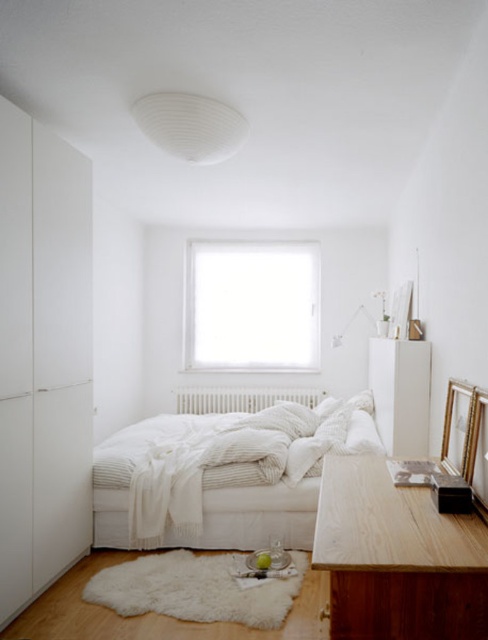
Question: Is white soft bed at center to the right of white matte radiator at center from the viewer's perspective?

Choices:
 (A) no
 (B) yes

Answer: (B)

Question: Which point is farther to the camera?

Choices:
 (A) transparent glass window at center
 (B) white matte wardrobe at left
 (C) white soft bed at center

Answer: (A)

Question: Is transparent glass window at center to the left of white matte lampshade at upper center from the viewer's perspective?

Choices:
 (A) no
 (B) yes

Answer: (A)

Question: Which object is farther from the camera taking this photo?

Choices:
 (A) white soft bed at center
 (B) white matte radiator at center
 (C) white matte lampshade at upper center
 (D) natural wood desk at lower right

Answer: (B)

Question: Is natural wood desk at lower right to the left of transparent glass window at center from the viewer's perspective?

Choices:
 (A) yes
 (B) no

Answer: (B)

Question: Which object is farther from the camera taking this photo?

Choices:
 (A) natural wood desk at lower right
 (B) white soft bed at center
 (C) white matte lampshade at upper center

Answer: (B)